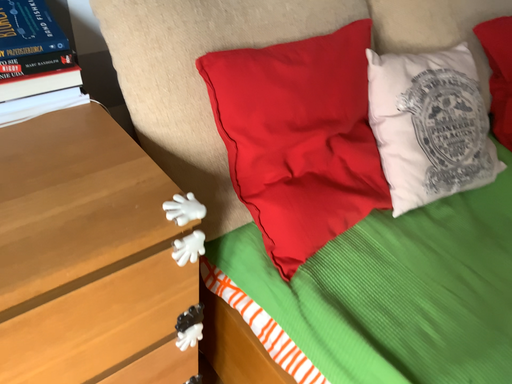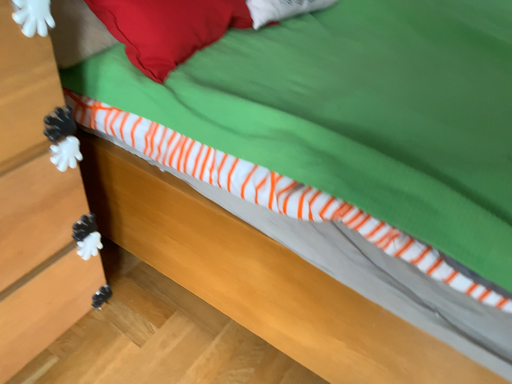
Question: Which way did the camera rotate in the video?

Choices:
 (A) rotated right
 (B) rotated left

Answer: (A)